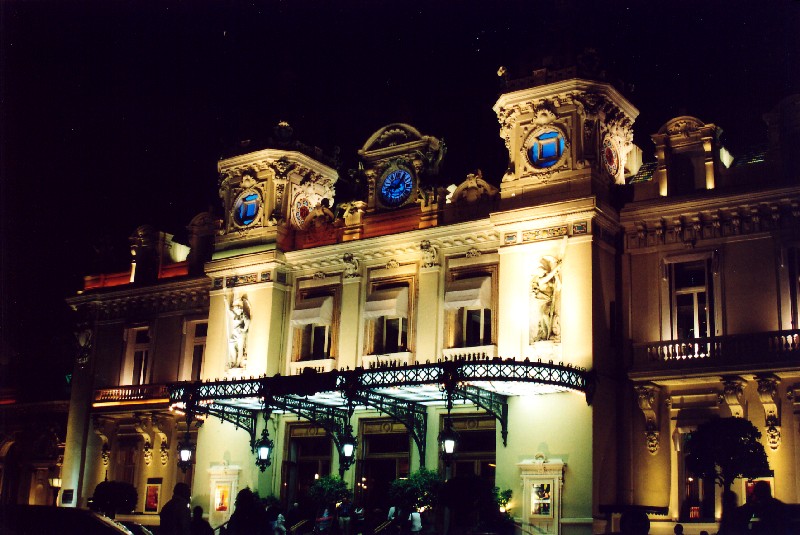
The height and width of the screenshot is (535, 800). I want to click on overhead lighting, so click(529, 385), click(422, 391), click(324, 400), click(246, 400).